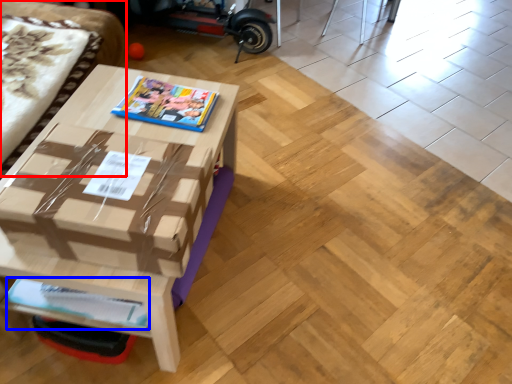
Question: Among these objects, which one is nearest to the camera, couch (highlighted by a red box) or magazine (highlighted by a blue box)?

Choices:
 (A) couch
 (B) magazine

Answer: (A)